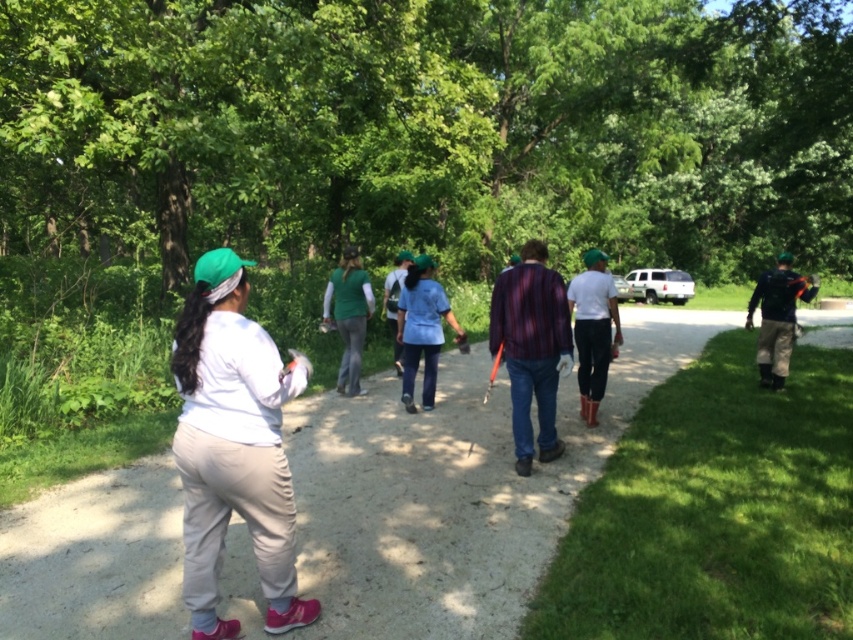
You are a photographer trying to capture the woman in the scene. You notice two fabrics on her upper body. Which fabric is closer to the camera between the white fabric at center and the green fabric shirt at center?

The white fabric at center is positioned under the green fabric shirt at center, so the green fabric shirt at center is closer to the camera.

You are a photographer standing at the end of the dirt path. You want to take a photo of the rubber boots at center and the dark blue jacket at right. Based on their positions, which object should appear lower in the photo?

The rubber boots at center should appear lower in the photo because it is below the dark blue jacket at right.